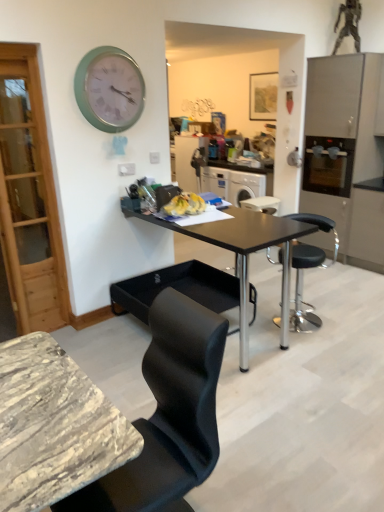
Identify the location of free space above teal metallic clock at upper left (from a real-world perspective). (107, 46).